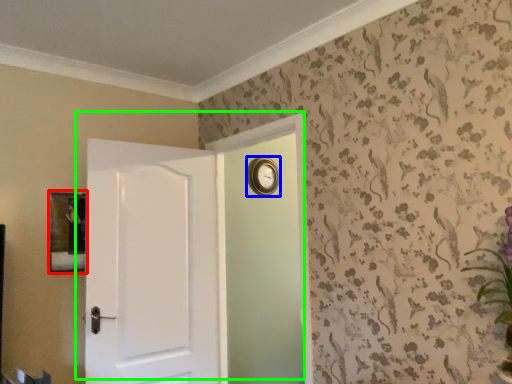
Question: Which object is positioned closest to picture frame (highlighted by a red box)? Select from clock (highlighted by a blue box) and door (highlighted by a green box).

Choices:
 (A) clock
 (B) door

Answer: (B)